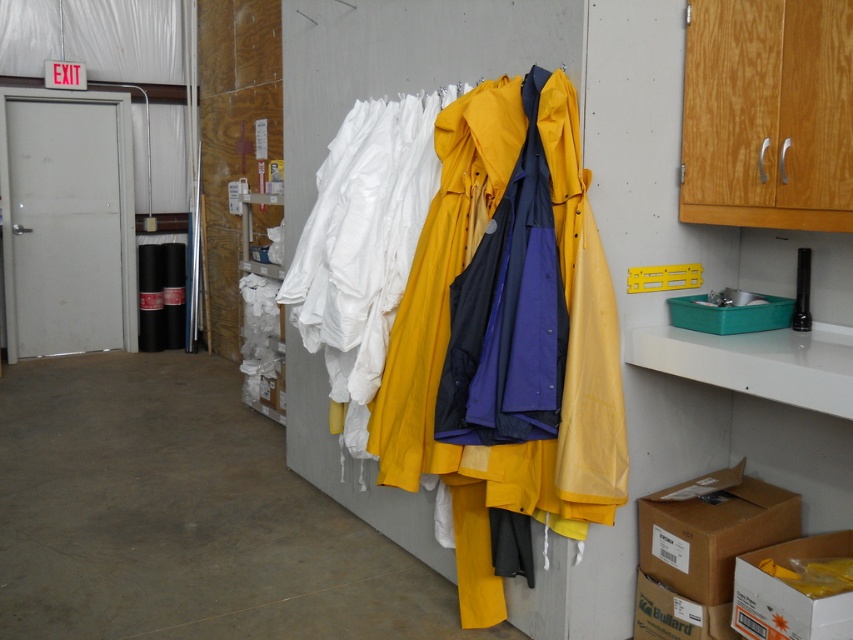
Question: Is yellow matte raincoat at center further to camera compared to brown cardboard box at lower right?

Choices:
 (A) yes
 (B) no

Answer: (B)

Question: Among these points, which one is nearest to the camera?

Choices:
 (A) coord(583,246)
 (B) coord(648,602)
 (C) coord(749,625)

Answer: (A)

Question: Which of the following is the farthest from the observer?

Choices:
 (A) yellow matte raincoat at center
 (B) cardboard box at lower right
 (C) white cardboard box at lower right

Answer: (B)

Question: Which point is closer to the camera?

Choices:
 (A) (730, 474)
 (B) (758, 625)
 (C) (714, 620)

Answer: (B)

Question: Observing the image, what is the correct spatial positioning of yellow matte raincoat at center in reference to cardboard box at lower right?

Choices:
 (A) above
 (B) below

Answer: (A)

Question: Does brown cardboard box at lower right appear under white cardboard box at lower right?

Choices:
 (A) yes
 (B) no

Answer: (B)